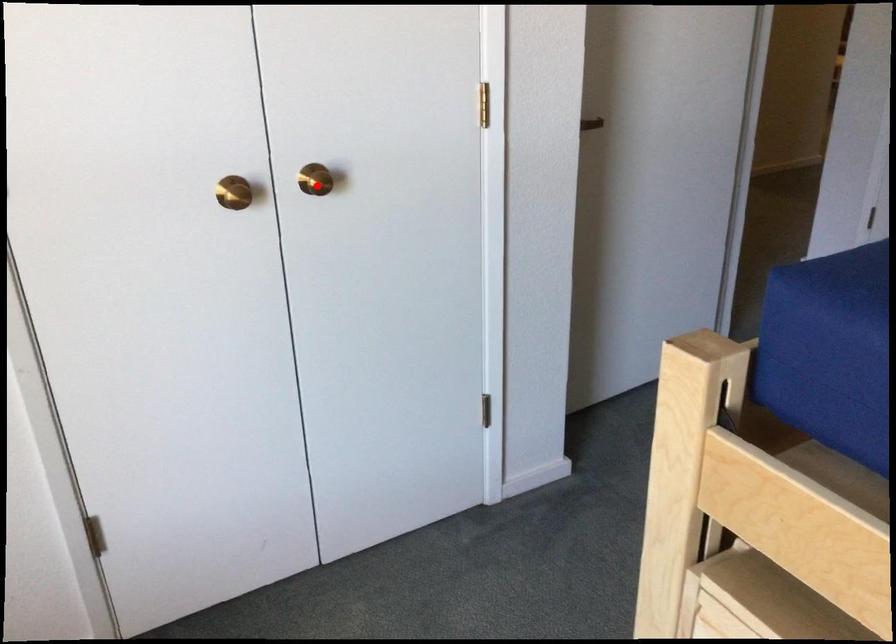
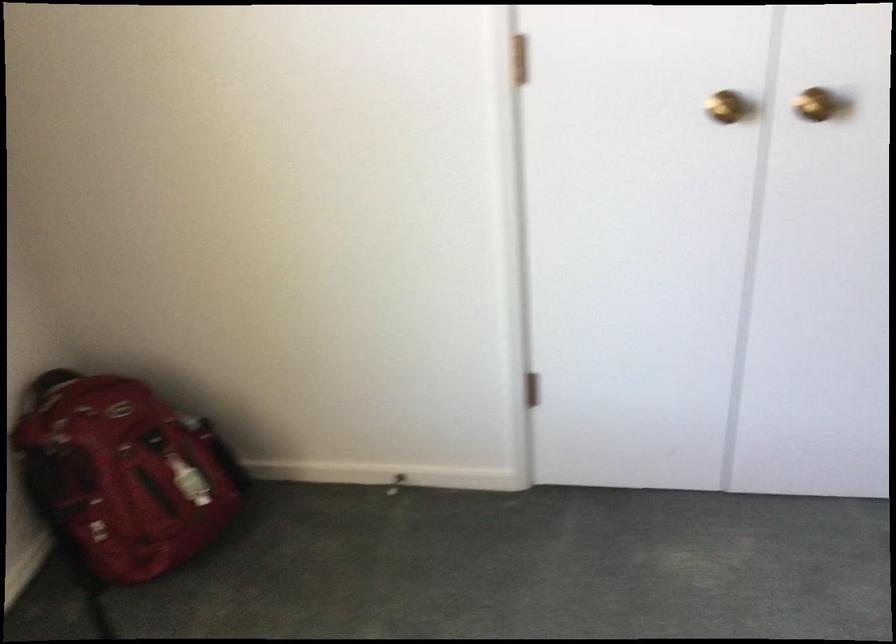
In the second image, find the point that corresponds to the highlighted location in the first image.

(814, 104)